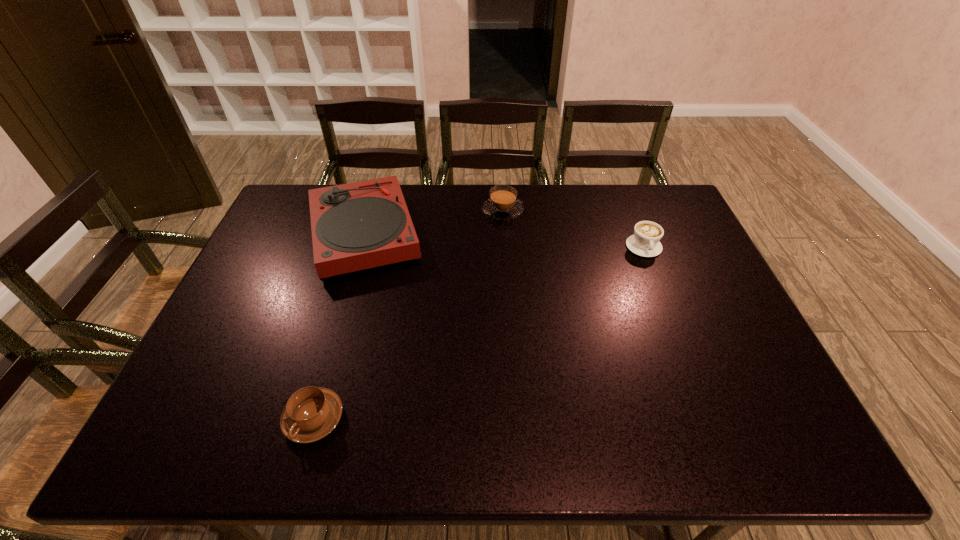
You are a GUI agent. You are given a task and a screenshot of the screen. Output one action in this format:
    pyautogui.click(x=<x>, y=<y>)
    Task: Click on the record player
    
    Given the screenshot: What is the action you would take?
    pyautogui.click(x=355, y=226)

Find the location of `the farthest cappuccino`. the farthest cappuccino is located at coordinates (503, 204).

Where is `the second object from right to left`? The height and width of the screenshot is (540, 960). the second object from right to left is located at coordinates (503, 204).

Where is `the rightmost cappuccino`? the rightmost cappuccino is located at coordinates (645, 242).

In order to click on the rightmost object in this screenshot , I will do `click(645, 242)`.

Where is `the nearest cappuccino`? The image size is (960, 540). the nearest cappuccino is located at coordinates (311, 413).

Locate an element on the screen. Image resolution: width=960 pixels, height=540 pixels. the nearest object is located at coordinates (311, 413).

Identify the location of vacant space situated on the front of the tallest object. Image resolution: width=960 pixels, height=540 pixels. (342, 312).

This screenshot has height=540, width=960. In order to click on vacant region located on the left of the farthest cappuccino in this screenshot , I will do `click(375, 211)`.

At what (x,y) coordinates should I click in order to perform the action: click on vacant point located 0.290m to the right of the second farthest cappuccino's handle. Please return your answer as a coordinate pair (x, y). This screenshot has height=540, width=960. Looking at the image, I should click on (679, 335).